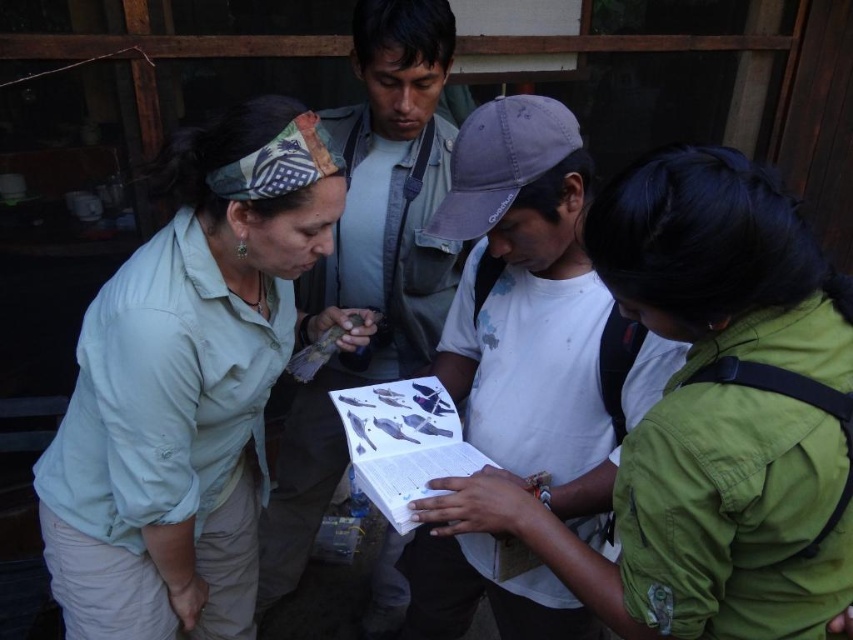
Between matte green shirt at center and matte gray shirt at center, which one appears on the left side from the viewer's perspective?

matte green shirt at center is more to the left.

Does matte green shirt at center have a greater width compared to matte gray shirt at center?

Yes, matte green shirt at center is wider than matte gray shirt at center.

Locate an element on the screen. The width and height of the screenshot is (853, 640). matte green shirt at center is located at coordinates (181, 403).

Can you confirm if green matte jacket at center is positioned below matte green shirt at center?

No.

From the picture: Can you confirm if green matte jacket at center is smaller than matte green shirt at center?

Correct, green matte jacket at center occupies less space than matte green shirt at center.

Does point (751, 275) come in front of point (155, 328)?

Yes, point (751, 275) is closer to viewer.

Where is `green matte jacket at center`? green matte jacket at center is located at coordinates (708, 417).

Is green matte jacket at center to the right of matte gray shirt at center from the viewer's perspective?

Yes, green matte jacket at center is to the right of matte gray shirt at center.

Where is `green matte jacket at center`? green matte jacket at center is located at coordinates (708, 417).

Find the location of a particular element. The image size is (853, 640). green matte jacket at center is located at coordinates (708, 417).